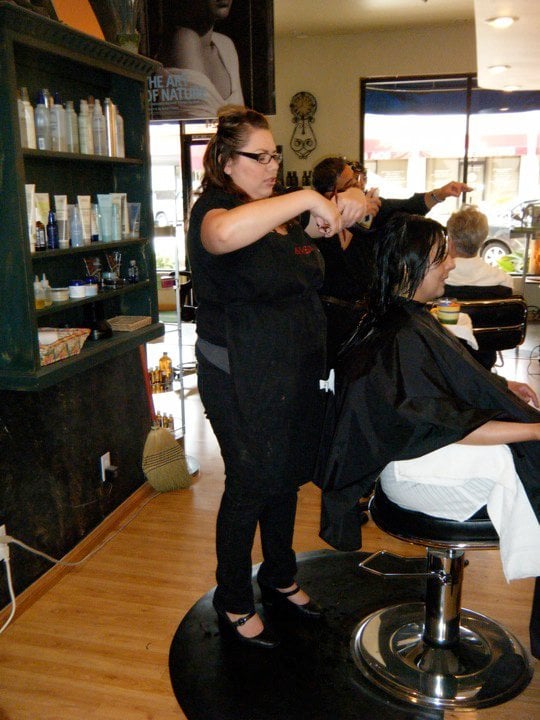
What are the coordinates of `broom` in the screenshot? It's located at (153, 438).